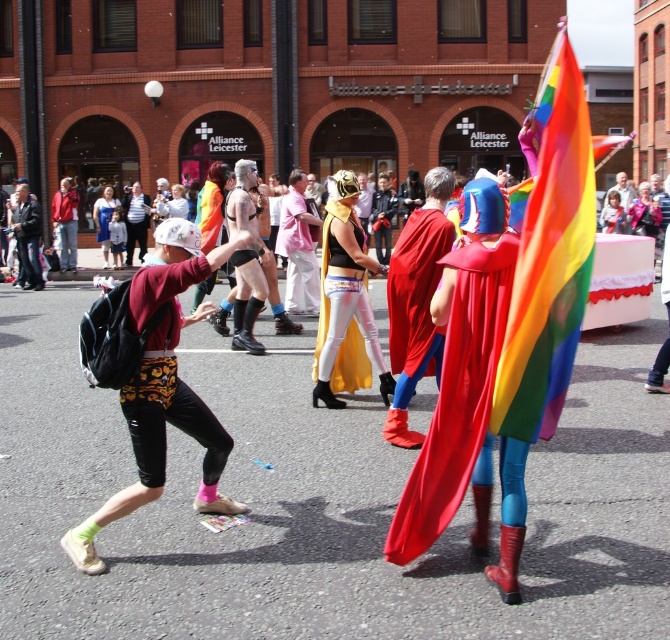
Question: Which point is closer to the camera?

Choices:
 (A) printed fabric shorts at left
 (B) matte black jacket at left

Answer: (A)

Question: Which point appears farthest from the camera in this image?

Choices:
 (A) (184, 381)
 (B) (399, 243)
 (C) (297, 188)
 (D) (29, 205)

Answer: (D)

Question: Can you confirm if rainbow fabric flag at center is positioned to the right of metallic gold mask at center?

Choices:
 (A) yes
 (B) no

Answer: (A)

Question: Observing the image, what is the correct spatial positioning of printed fabric shorts at left in reference to matte black jacket at left?

Choices:
 (A) right
 (B) left

Answer: (A)

Question: Which object is farther from the camera taking this photo?

Choices:
 (A) red fabric cape at center
 (B) metallic gold mask at center

Answer: (B)

Question: Does printed fabric shorts at left have a greater width compared to metallic gold mask at center?

Choices:
 (A) yes
 (B) no

Answer: (A)